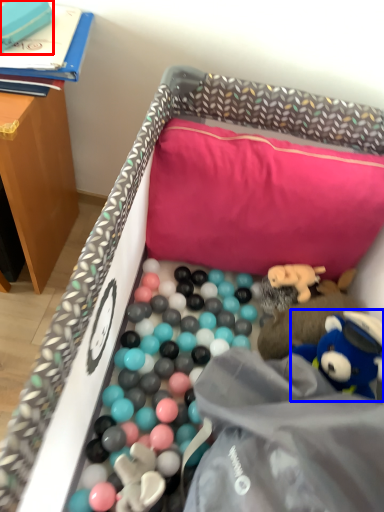
Question: Which object appears closest to the camera in this image, toy (highlighted by a red box) or toy (highlighted by a blue box)?

Choices:
 (A) toy
 (B) toy

Answer: (B)